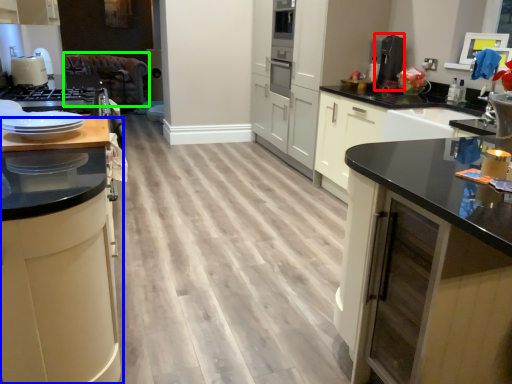
Question: Based on their relative distances, which object is farther from coffee machine (highlighted by a red box)? Choose from cabinetry (highlighted by a blue box) and brown (highlighted by a green box).

Choices:
 (A) cabinetry
 (B) brown

Answer: (B)